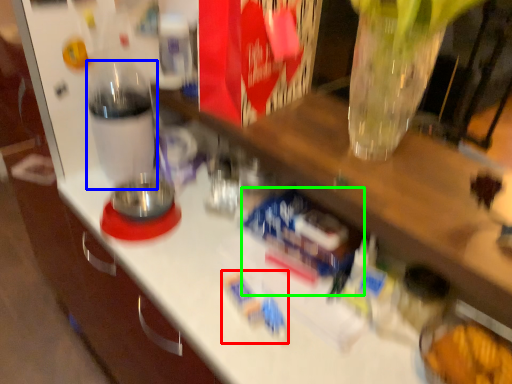
Question: Estimate the real-world distances between objects in this image. Which object is closer to toy (highlighted by a red box), bottle (highlighted by a blue box) or toy (highlighted by a green box)?

Choices:
 (A) bottle
 (B) toy

Answer: (B)